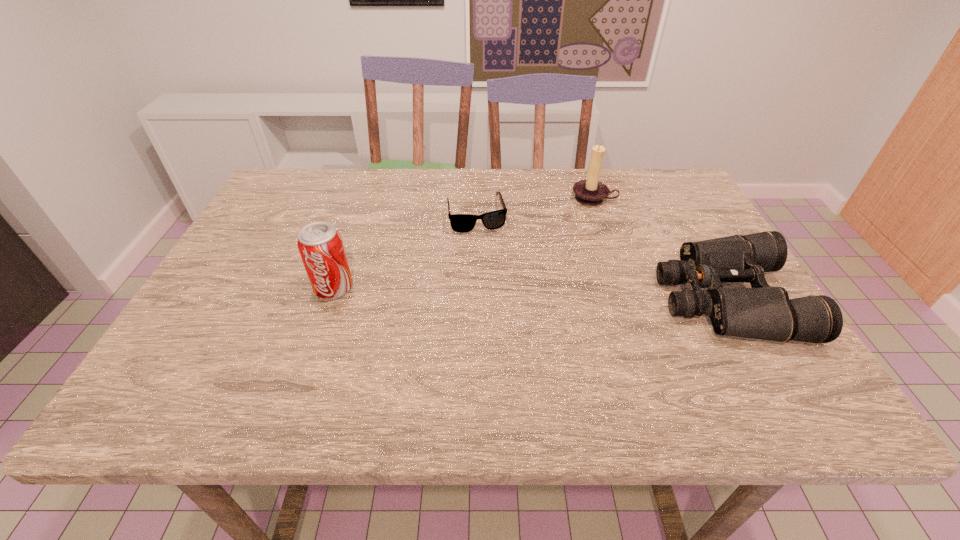
The image size is (960, 540). I want to click on free spot that satisfies the following two spatial constraints: 1. on the front side of the binoculars; 2. through the eyepieces of the third object from left to right, so click(x=627, y=299).

You are a GUI agent. You are given a task and a screenshot of the screen. Output one action in this format:
    pyautogui.click(x=<x>, y=<y>)
    Task: Click on the vacant space that satisfies the following two spatial constraints: 1. on the front side of the candle holder; 2. through the eyepieces of the rightmost object
    
    Given the screenshot: What is the action you would take?
    pyautogui.click(x=627, y=299)